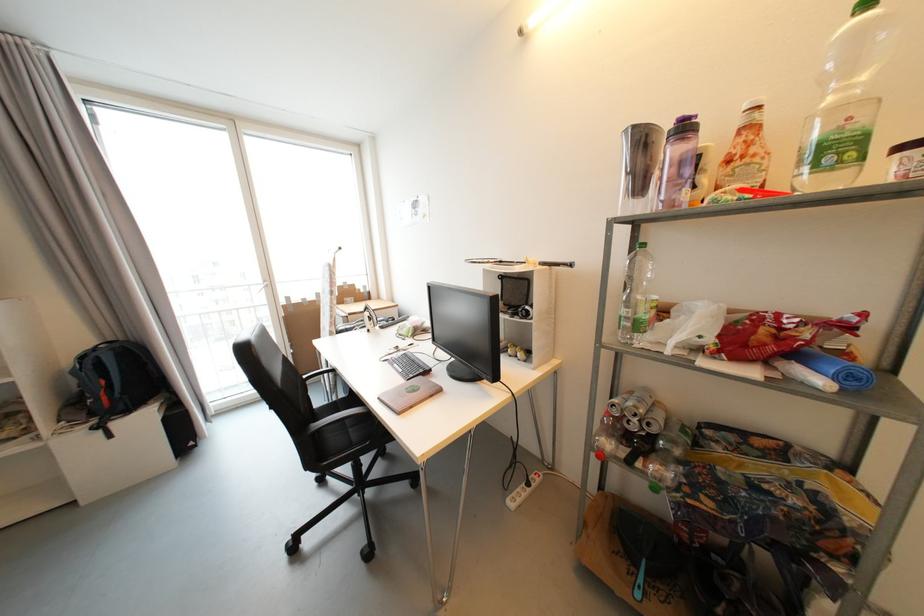
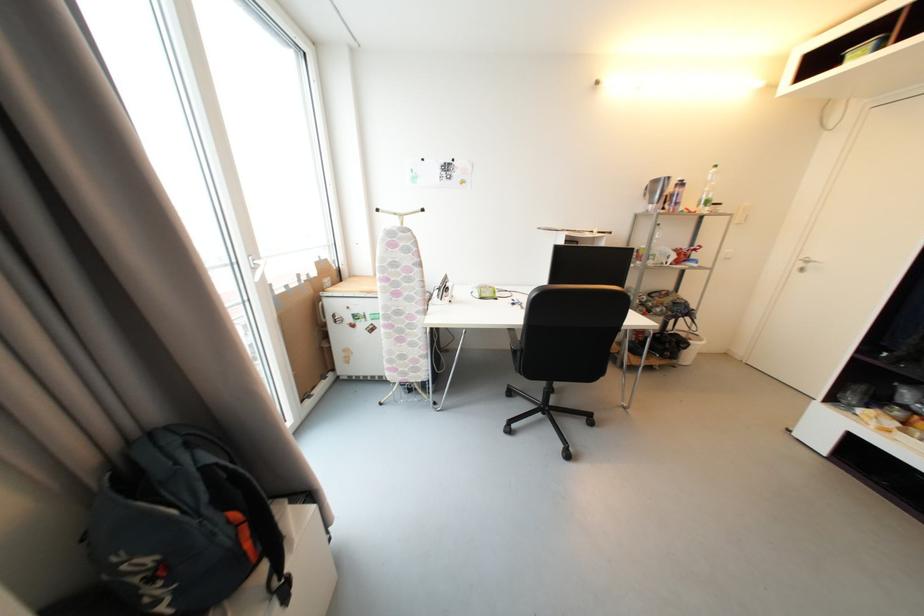
Find the pixel in the second image that matches pixel 810 171 in the first image.

(707, 208)